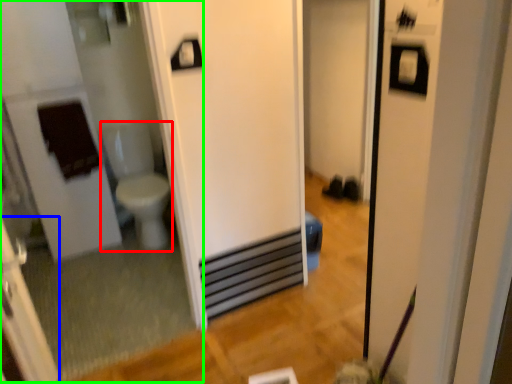
Question: Which object is positioned farthest from toilet bowl (highlighted by a red box)? Select from screen door (highlighted by a blue box) and mirror (highlighted by a green box).

Choices:
 (A) screen door
 (B) mirror

Answer: (A)